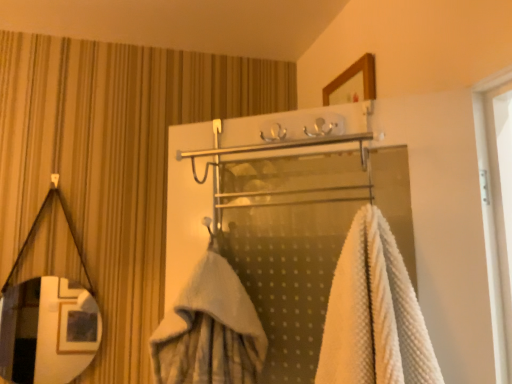
What do you see at coordinates (374, 313) in the screenshot? This screenshot has width=512, height=384. I see `white textured towel at center` at bounding box center [374, 313].

Locate an element on the screen. white textured towel at center is located at coordinates (374, 313).

Locate an element on the screen. The image size is (512, 384). white textured towel at center is located at coordinates (374, 313).